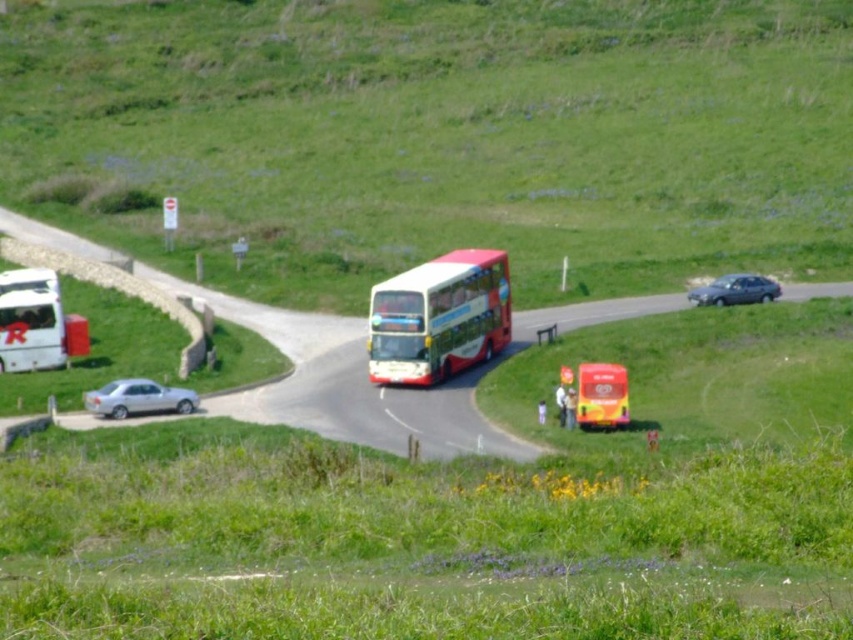
You are standing at the road intersection in the image and want to walk towards the two points marked in the scene. Which point, point (144, 397) or point (724, 305), will you reach first?

Point (144, 397) is closer to the viewer than point (724, 305), so you will reach point (144, 397) first.

You are a pedestrian standing on the grassy terrain with yellow wildflowers in the foreground. You need to cross the road to reach the red double decker bus at center. Which vehicle, the silver metallic car at lower left or the metallic gray sedan at right, is closer to the road intersection?

The silver metallic car at lower left is positioned under the metallic gray sedan at right, meaning it is closer to the road intersection than the metallic gray sedan at right.

You are a pedestrian standing at the intersection and want to cross the road. There is a white glossy bus at center and a silver metallic car at lower left. Which vehicle is closer to you?

The silver metallic car at lower left is closer to you because the white glossy bus at center is located above it, meaning the bus is further away in the scene.